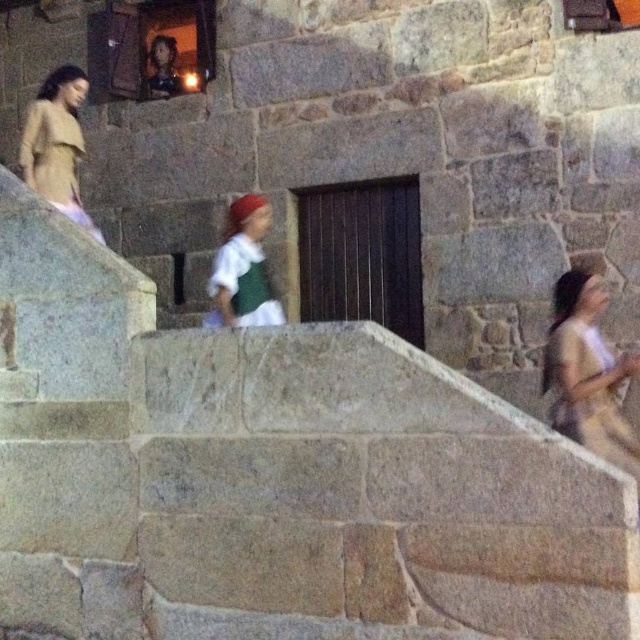
Question: Is gray stone stairs at center wider than matte beige coat at upper left?

Choices:
 (A) no
 (B) yes

Answer: (B)

Question: Observing the image, what is the correct spatial positioning of matte beige dress at right in reference to green fabric dress at center?

Choices:
 (A) below
 (B) above

Answer: (A)

Question: Does gray stone stairs at center lie in front of green fabric dress at center?

Choices:
 (A) no
 (B) yes

Answer: (B)

Question: Which object appears closest to the camera in this image?

Choices:
 (A) green fabric dress at center
 (B) gray stone stairs at center
 (C) matte beige coat at upper left
 (D) matte beige dress at right

Answer: (B)

Question: Among these points, which one is nearest to the camera?

Choices:
 (A) (61, 102)
 (B) (586, 445)
 (C) (244, 227)

Answer: (B)

Question: Considering the real-world distances, which object is closest to the matte beige coat at upper left?

Choices:
 (A) gray stone stairs at center
 (B) matte beige dress at right
 (C) green fabric dress at center

Answer: (C)